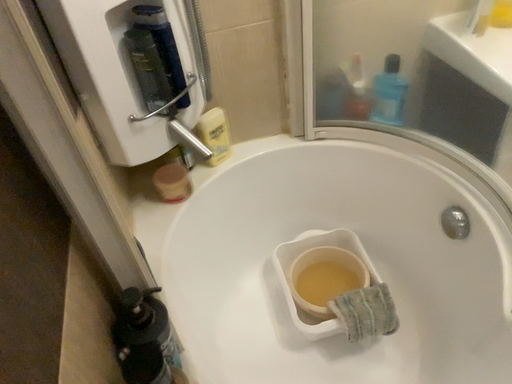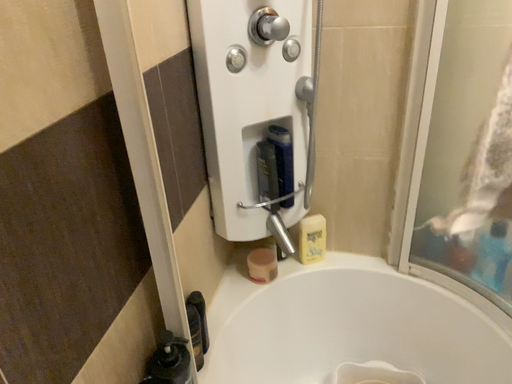
Question: How did the camera likely rotate when shooting the video?

Choices:
 (A) rotated left
 (B) rotated right

Answer: (A)